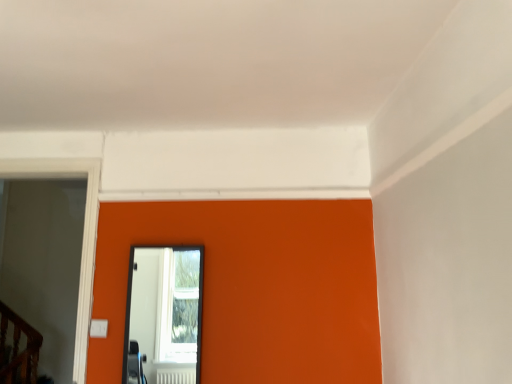
The height and width of the screenshot is (384, 512). I want to click on black glass mirror at center, so click(164, 315).

Describe the element at coordinates (164, 315) in the screenshot. The height and width of the screenshot is (384, 512). I see `black glass mirror at center` at that location.

Measure the distance between black glass mirror at center and camera.

The distance of black glass mirror at center from camera is 5.02 meters.

The height and width of the screenshot is (384, 512). Identify the location of transparent glass door at left. (83, 234).

The image size is (512, 384). What do you see at coordinates (83, 234) in the screenshot?
I see `transparent glass door at left` at bounding box center [83, 234].

You are a GUI agent. You are given a task and a screenshot of the screen. Output one action in this format:
    pyautogui.click(x=<x>, y=<y>)
    Task: Click on the black glass mirror at center
    
    Given the screenshot: What is the action you would take?
    pyautogui.click(x=164, y=315)

Considering the relative positions of black glass mirror at center and transparent glass door at left in the image provided, is black glass mirror at center to the left or to the right of transparent glass door at left?

black glass mirror at center is to the right of transparent glass door at left.

Is the position of black glass mirror at center less distant than that of transparent glass door at left?

No, black glass mirror at center is further to the viewer.

Is point (146, 335) positioned behind point (93, 215)?

Yes, point (146, 335) is behind point (93, 215).

From the image's perspective, which is above, black glass mirror at center or transparent glass door at left?

transparent glass door at left appears higher in the image.

From a real-world perspective, is black glass mirror at center positioned under transparent glass door at left based on gravity?

Yes, from a real-world perspective, black glass mirror at center is beneath transparent glass door at left.

Which object is wider, black glass mirror at center or transparent glass door at left?

transparent glass door at left.

Based on the photo, can you confirm if black glass mirror at center is taller than transparent glass door at left?

No, black glass mirror at center is not taller than transparent glass door at left.

From the picture: Considering the sizes of black glass mirror at center and transparent glass door at left in the image, is black glass mirror at center bigger or smaller than transparent glass door at left?

Considering their sizes, black glass mirror at center takes up less space than transparent glass door at left.

Can transparent glass door at left be found inside black glass mirror at center?

No, transparent glass door at left is not inside black glass mirror at center.

Is black glass mirror at center with transparent glass door at left?

black glass mirror at center and transparent glass door at left are clearly separated.

Is black glass mirror at center facing away from transparent glass door at left?

black glass mirror at center does not have its back to transparent glass door at left.

What's the angular difference between black glass mirror at center and transparent glass door at left's facing directions?

The angular difference between black glass mirror at center and transparent glass door at left is 1 degrees.

How distant is black glass mirror at center from transparent glass door at left?

The distance of black glass mirror at center from transparent glass door at left is 3.47 meters.

This screenshot has width=512, height=384. In the image, there is a transparent glass door at left. What are the coordinates of `mirror below it (from a real-world perspective)` in the screenshot? It's located at (164, 315).

Between transparent glass door at left and black glass mirror at center, which one appears on the left side from the viewer's perspective?

transparent glass door at left.

Is transparent glass door at left in front of black glass mirror at center?

That is True.

Which point is more forward, (49, 170) or (172, 246)?

The point (172, 246) is more forward.

From the image's perspective, is transparent glass door at left positioned above or below black glass mirror at center?

transparent glass door at left is situated higher than black glass mirror at center in the image.

From a real-world perspective, which is physically below, transparent glass door at left or black glass mirror at center?

black glass mirror at center, from a real-world perspective.

Considering the relative sizes of transparent glass door at left and black glass mirror at center in the image provided, is transparent glass door at left wider than black glass mirror at center?

Yes.

Which of these two, transparent glass door at left or black glass mirror at center, stands taller?

transparent glass door at left is taller.

Considering the sizes of objects transparent glass door at left and black glass mirror at center in the image provided, who is bigger, transparent glass door at left or black glass mirror at center?

With larger size is transparent glass door at left.

Would you say transparent glass door at left contains black glass mirror at center?

No.

Is transparent glass door at left not near black glass mirror at center?

Indeed, transparent glass door at left is not near black glass mirror at center.

Is transparent glass door at left aimed at black glass mirror at center?

No, transparent glass door at left is not aimed at black glass mirror at center.

Find the location of `glass door above the black glass mirror at center (from a real-world perspective)`. glass door above the black glass mirror at center (from a real-world perspective) is located at coordinates tap(83, 234).

In the image, there is a black glass mirror at center. Identify the location of glass door above it (from the image's perspective). (83, 234).

Where is `glass door in front of the black glass mirror at center`? glass door in front of the black glass mirror at center is located at coordinates (83, 234).